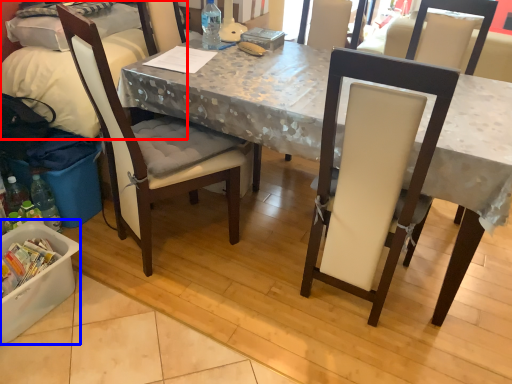
Question: Which object is closer to the camera taking this photo, leftover (highlighted by a red box) or box (highlighted by a blue box)?

Choices:
 (A) leftover
 (B) box

Answer: (B)